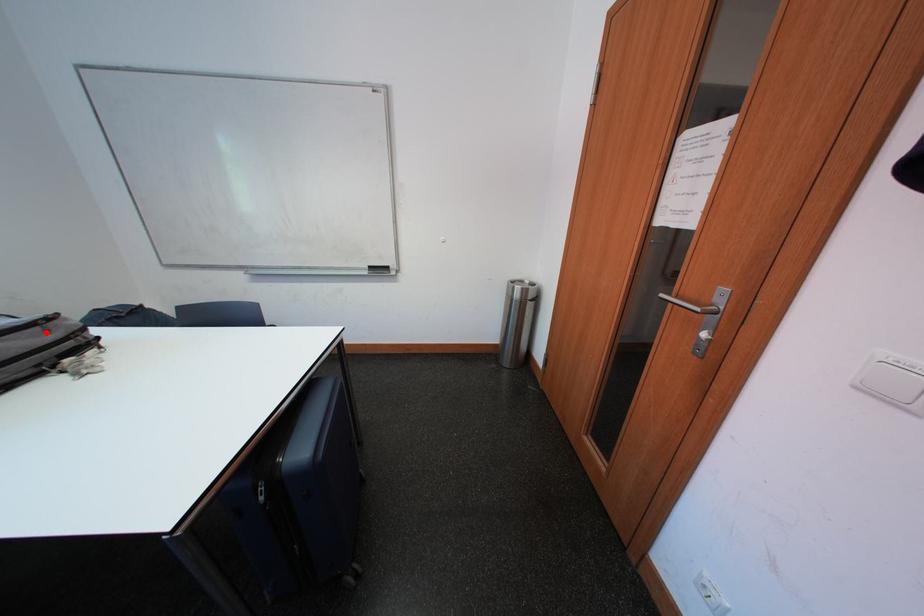
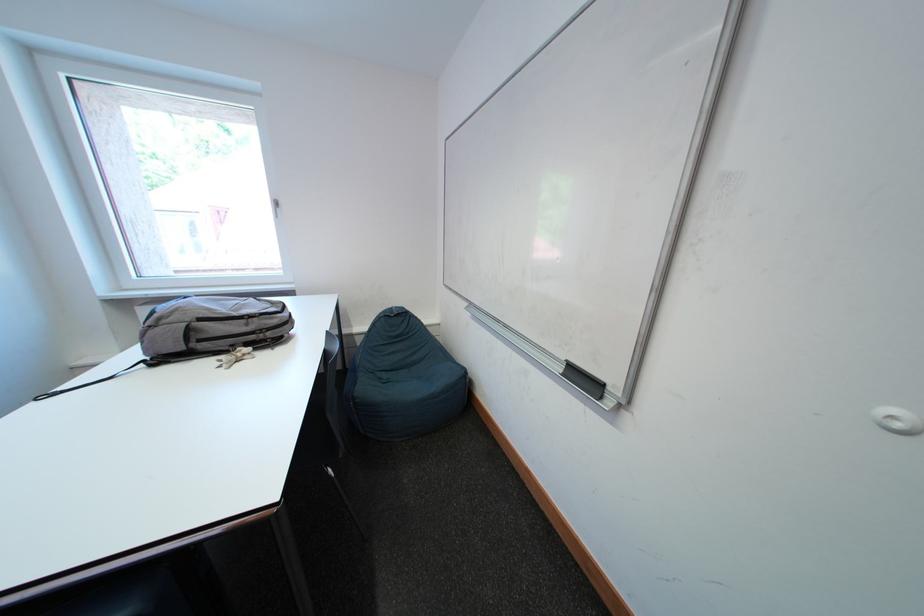
Question: A red point is marked in image1. In image2, is the corresponding 3D point closer to the camera or farther? Reply with the corresponding letter.

Choices:
 (A) The corresponding 3D point is closer.
 (B) The corresponding 3D point is farther.

Answer: (A)